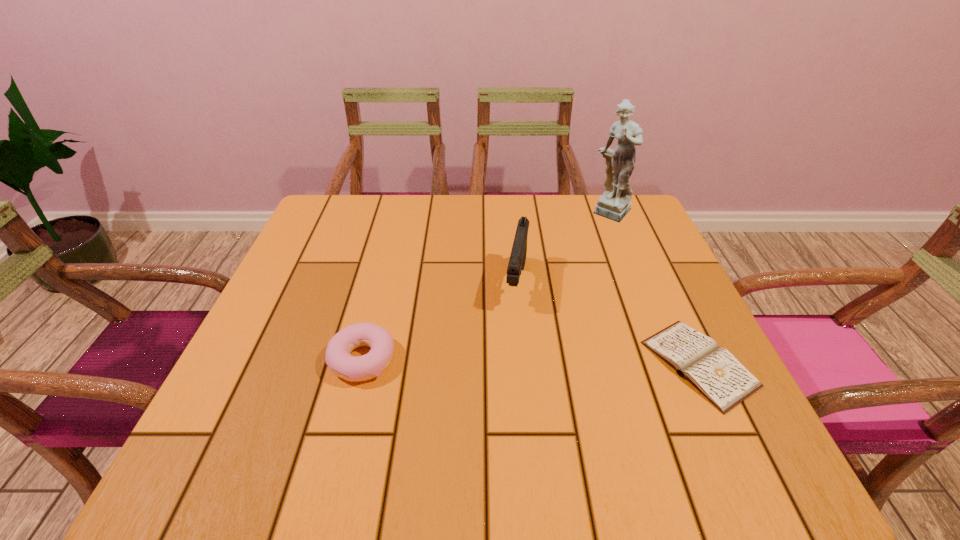
Find the location of `the third tallest object`. the third tallest object is located at coordinates (338, 358).

Find the location of a particular element. This screenshot has width=960, height=540. the leftmost object is located at coordinates (338, 358).

Find the location of a particular element. The image size is (960, 540). diary is located at coordinates (714, 371).

The width and height of the screenshot is (960, 540). What are the coordinates of `the third shortest object` in the screenshot? It's located at pyautogui.click(x=517, y=259).

You are a GUI agent. You are given a task and a screenshot of the screen. Output one action in this format:
    pyautogui.click(x=<x>, y=<y>)
    Task: Click on the second farthest object
    This screenshot has height=540, width=960.
    Given the screenshot: What is the action you would take?
    pyautogui.click(x=517, y=259)

Locate an element on the screen. figurine is located at coordinates (614, 204).

Identify the location of the tallest object. (614, 204).

Identify the location of vacant space located 0.150m on the right of the doughnut. Image resolution: width=960 pixels, height=540 pixels. (473, 360).

Locate an element on the screen. The width and height of the screenshot is (960, 540). vacant space located 0.060m on the back of the shortest object is located at coordinates (670, 301).

The width and height of the screenshot is (960, 540). In order to click on vacant region located 0.220m at the barrel of the second object from left to right in this screenshot , I will do `click(499, 400)`.